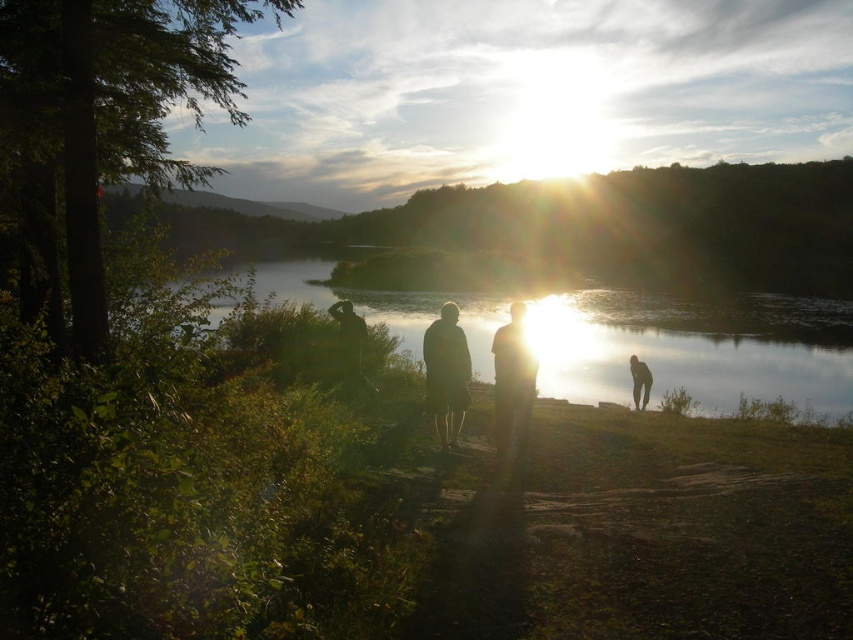
You are standing at the lakeside and want to take a photo of the two points marked in the scene. Which point, point (844, 316) or point (502, 388), is closer to your camera when taking the photo?

Point (502, 388) is closer to the camera than point (844, 316), so it will appear larger in the photo.

You are standing on the lakeside and see the glistening reflective water at center and the silhouette figure at center. Which object is closer to the top of the image?

The glistening reflective water at center is located above the silhouette figure at center, so it is closer to the top of the image.